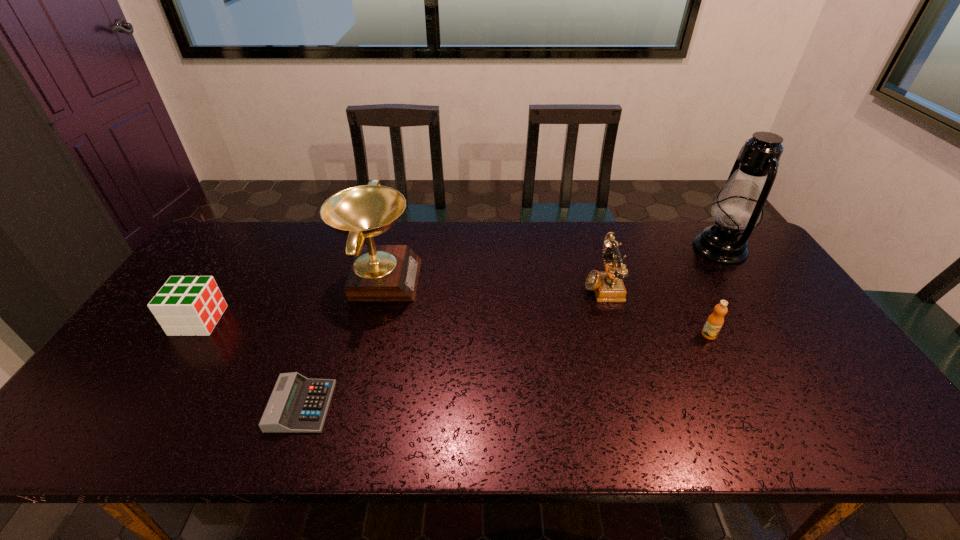
This screenshot has width=960, height=540. Identify the location of oil lamp. (739, 204).

Locate an element on the screen. The height and width of the screenshot is (540, 960). the tallest object is located at coordinates (739, 204).

The width and height of the screenshot is (960, 540). In order to click on the fifth shortest object in this screenshot , I will do (x=379, y=273).

Where is `the third tallest object`? the third tallest object is located at coordinates (608, 286).

Where is `the third object from right to left`? the third object from right to left is located at coordinates (608, 286).

Locate an element on the screen. The width and height of the screenshot is (960, 540). the second object from right to left is located at coordinates (714, 323).

You are a GUI agent. You are given a task and a screenshot of the screen. Output one action in this format:
    pyautogui.click(x=<x>, y=<y>)
    Task: Click on the cube
    The image size is (960, 540).
    Given the screenshot: What is the action you would take?
    pyautogui.click(x=192, y=305)

The image size is (960, 540). Find the location of `the nearest object`. the nearest object is located at coordinates (297, 404).

At what (x,y) coordinates should I click in order to perform the action: click on calculator. Please return your answer as a coordinate pair (x, y). The width and height of the screenshot is (960, 540). Looking at the image, I should click on (297, 404).

Find the location of a particular element. The image size is (960, 540). free space located 0.230m on the left of the oil lamp is located at coordinates (625, 249).